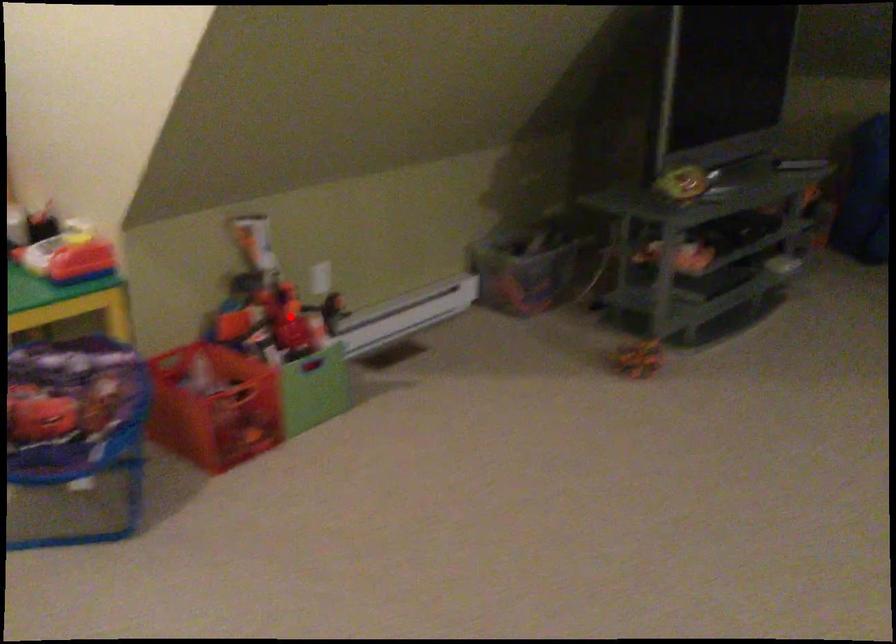
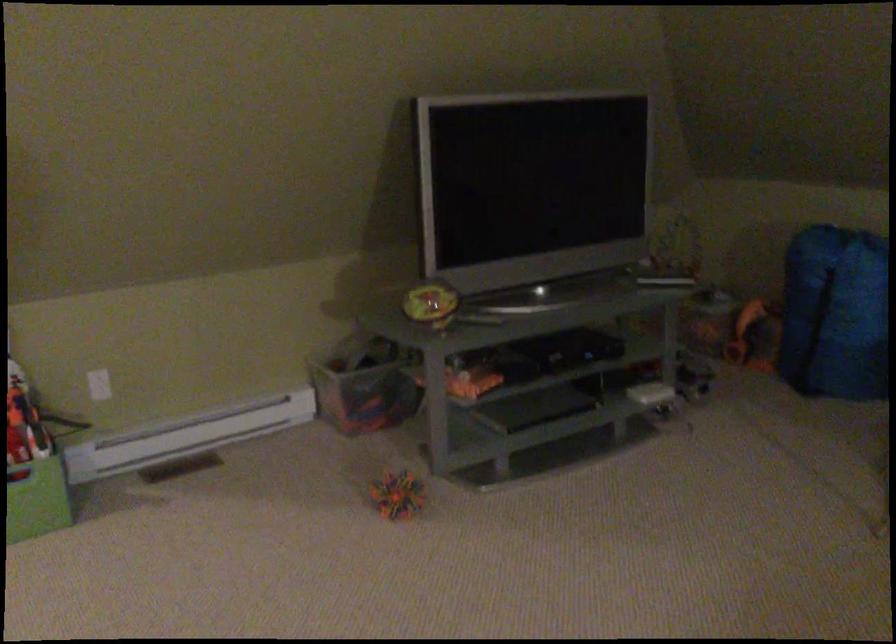
Question: I am providing you with two images of the same scene from different viewpoints. A red point is marked on the first image. At the location where the point appears in image 1, is it still visible in image 2?

Choices:
 (A) Yes
 (B) No

Answer: (A)